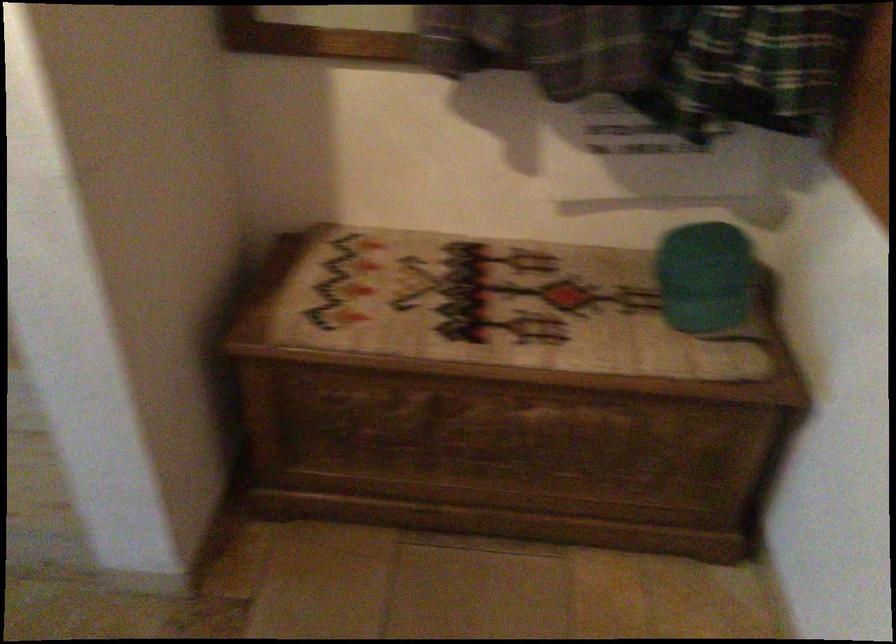
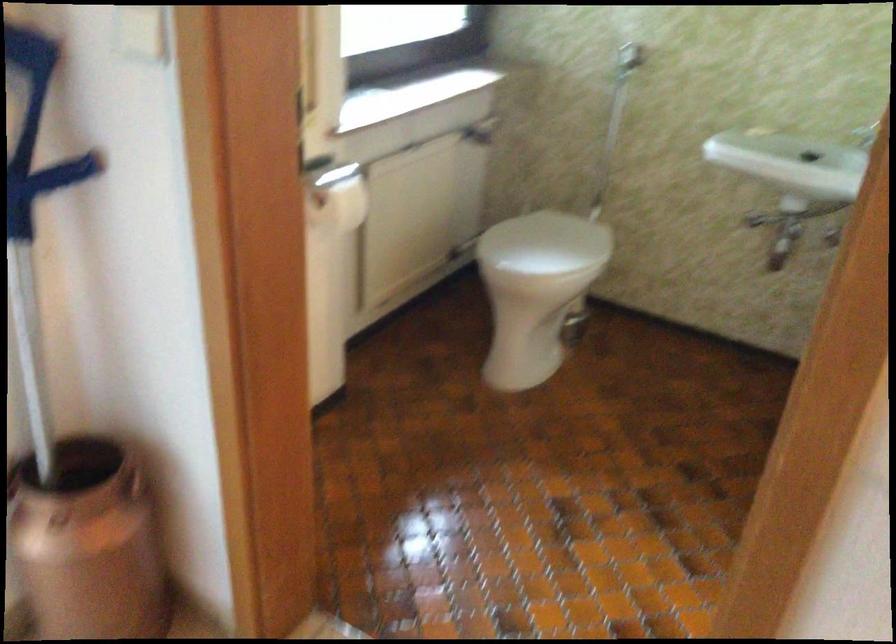
Question: In a continuous first-person perspective shot, in which direction is the camera moving?

Choices:
 (A) Left
 (B) Right
 (C) Forward
 (D) Backward

Answer: (A)